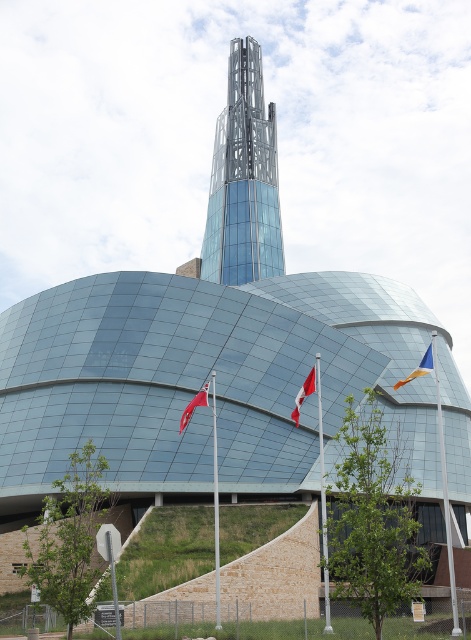
You are a drone operator planning to fly a drone between the transparent glass tower at center and the orange fabric flag at right. The drone has a maximum flight distance of 50 meters. Based on the scene, can the drone safely travel between these two points without exceeding its range?

The transparent glass tower at center and orange fabric flag at right are 55.82 meters apart from each other. Since the drone has a maximum flight distance of 50 meters, it cannot safely travel between these two points without exceeding its range.

You are standing in front of the modern building and want to take a photo of both the transparent glass tower at center and the orange fabric flag at right. Which one should you focus on first to ensure both are in frame?

You should focus on the transparent glass tower at center first because it is located above the orange fabric flag at right, so adjusting the camera angle to include the tower will naturally include the flag below it.

You are standing in front of the modern building and see the transparent glass tower at center and the orange fabric flag at right. Which object is positioned to the left of the other?

The transparent glass tower at center is to the left of orange fabric flag at right according to the description.